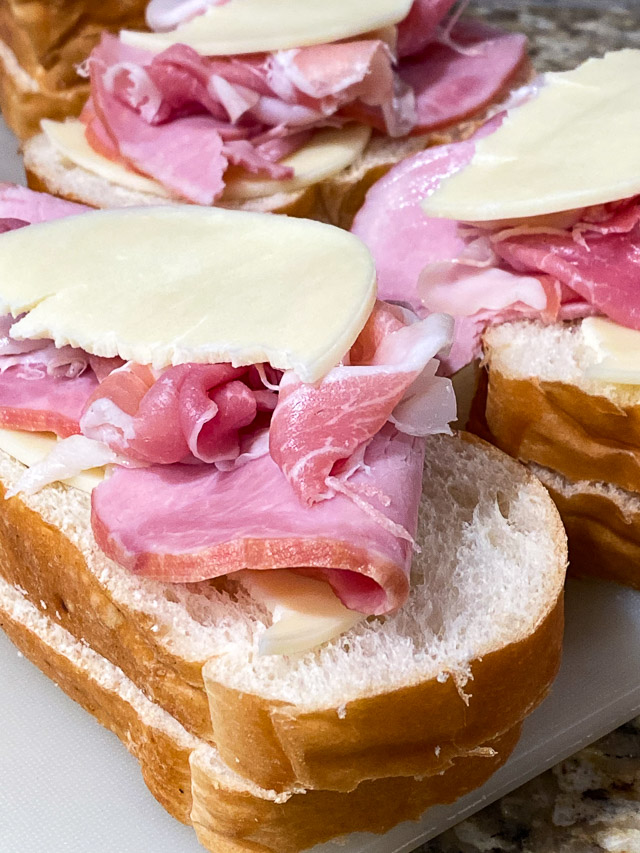
In order to click on gray table in this screenshot , I will do `click(566, 706)`.